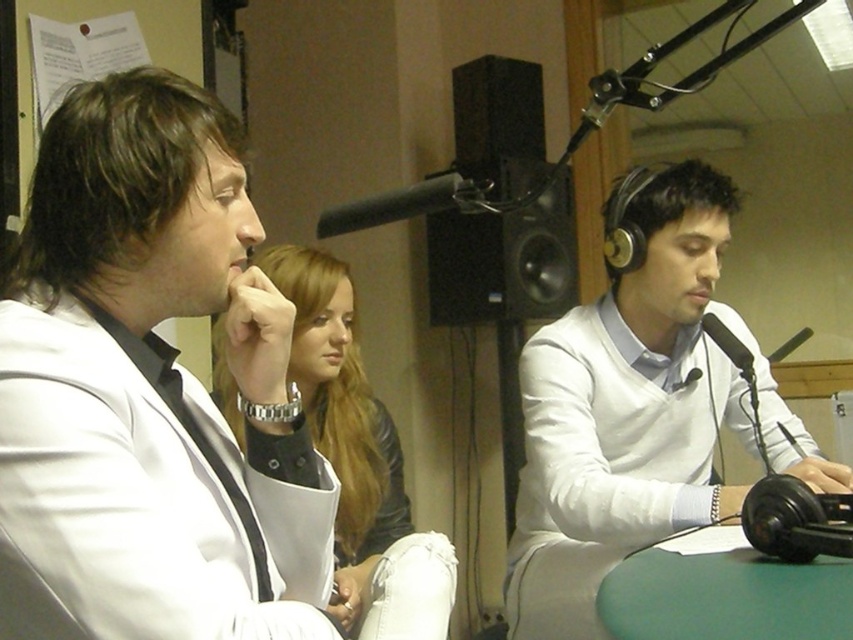
You are a sound engineer in this radio studio. You need to adjust the microphone stand so that the black matte microphone at upper center is positioned above the leather jacket at center. Is the microphone currently placed correctly?

The leather jacket at center is below the black matte microphone at upper center, so the microphone is already positioned above the leather jacket at center. Therefore, the microphone is currently placed correctly.